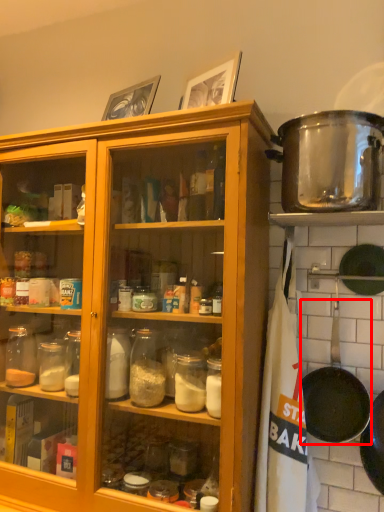
Question: In this image, where is frying pan (annotated by the red box) located relative to pot/pan?

Choices:
 (A) left
 (B) right

Answer: (B)